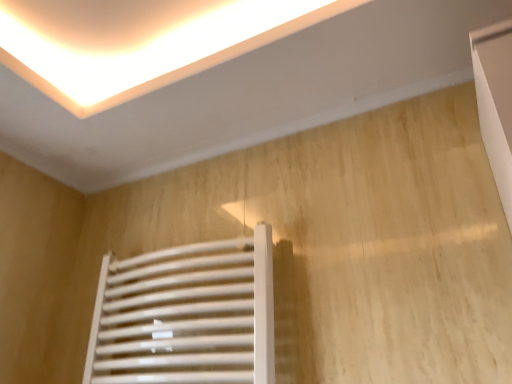
The image size is (512, 384). What do you see at coordinates (186, 316) in the screenshot?
I see `white matte radiator at lower left` at bounding box center [186, 316].

At what (x,y) coordinates should I click in order to perform the action: click on white matte radiator at lower left. Please return your answer as a coordinate pair (x, y). This screenshot has width=512, height=384. Looking at the image, I should click on (186, 316).

You are a GUI agent. You are given a task and a screenshot of the screen. Output one action in this format:
    pyautogui.click(x=<x>, y=<y>)
    Task: Click on the white matte radiator at lower left
    Image resolution: width=512 pixels, height=384 pixels.
    Given the screenshot: What is the action you would take?
    pyautogui.click(x=186, y=316)